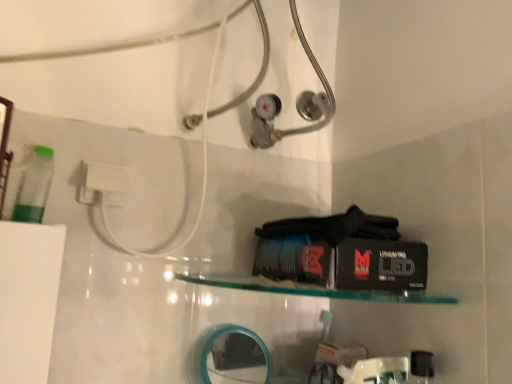
Question: Would you consider white plastic plug at upper left to be distant from clear glass shelf at center?

Choices:
 (A) yes
 (B) no

Answer: (B)

Question: Considering the relative sizes of white plastic plug at upper left and clear glass shelf at center in the image provided, is white plastic plug at upper left wider than clear glass shelf at center?

Choices:
 (A) no
 (B) yes

Answer: (A)

Question: Is white plastic plug at upper left to the left of clear glass shelf at center from the viewer's perspective?

Choices:
 (A) yes
 (B) no

Answer: (A)

Question: Is white plastic plug at upper left facing towards clear glass shelf at center?

Choices:
 (A) no
 (B) yes

Answer: (A)

Question: Is white plastic plug at upper left not inside clear glass shelf at center?

Choices:
 (A) no
 (B) yes

Answer: (B)

Question: In terms of width, does teal plastic mirror at lower center look wider or thinner when compared to clear glass shelf at center?

Choices:
 (A) wide
 (B) thin

Answer: (B)

Question: From a real-world perspective, relative to clear glass shelf at center, is teal plastic mirror at lower center vertically above or below?

Choices:
 (A) below
 (B) above

Answer: (A)

Question: Is teal plastic mirror at lower center taller or shorter than clear glass shelf at center?

Choices:
 (A) tall
 (B) short

Answer: (A)

Question: Is teal plastic mirror at lower center bigger or smaller than clear glass shelf at center?

Choices:
 (A) big
 (B) small

Answer: (B)

Question: From a real-world perspective, is teal plastic mirror at lower center positioned above or below white plastic plug at upper left?

Choices:
 (A) below
 (B) above

Answer: (A)

Question: Is teal plastic mirror at lower center wider or thinner than white plastic plug at upper left?

Choices:
 (A) wide
 (B) thin

Answer: (A)

Question: Looking at the image, does teal plastic mirror at lower center seem bigger or smaller compared to white plastic plug at upper left?

Choices:
 (A) big
 (B) small

Answer: (A)

Question: Choose the correct answer: Is teal plastic mirror at lower center inside white plastic plug at upper left or outside it?

Choices:
 (A) outside
 (B) inside

Answer: (A)

Question: From their relative heights in the image, would you say clear glass shelf at center is taller or shorter than white plastic plug at upper left?

Choices:
 (A) short
 (B) tall

Answer: (A)

Question: In terms of width, does clear glass shelf at center look wider or thinner when compared to white plastic plug at upper left?

Choices:
 (A) wide
 (B) thin

Answer: (A)